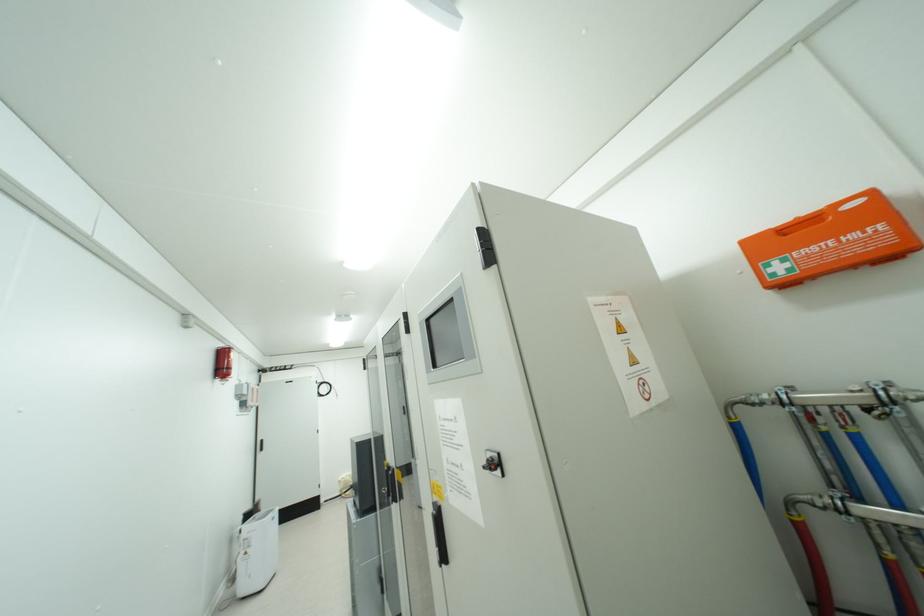
Image resolution: width=924 pixels, height=616 pixels. Identify the location of black cabinet handle. (439, 533).